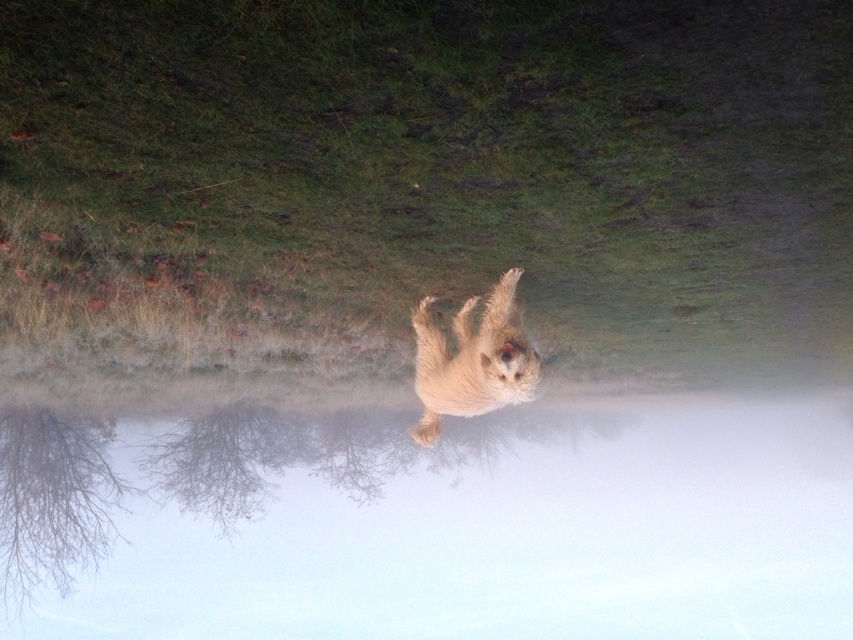
Based on the photo, you are standing in the scene and want to walk from point (729, 628) to point (471, 364). Which direction should you face to move towards the closer point?

You should face towards point (471, 364) because it is closer to you than point (729, 628).

You are a photographer trying to capture the perfect shot of the fuzzy fur dog at center and the foggy water at center. Based on their positions, which object is closer to the camera?

The fuzzy fur dog at center is closer to the camera because it is positioned above the foggy water at center, which is located below it.